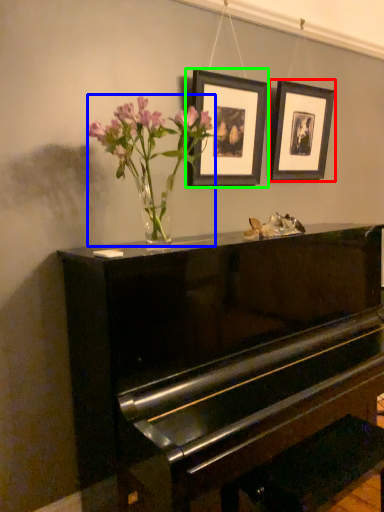
Question: Considering the real-world distances, which object is closest to picture frame (highlighted by a red box)? floral arrangement (highlighted by a blue box) or picture frame (highlighted by a green box).

Choices:
 (A) floral arrangement
 (B) picture frame

Answer: (B)